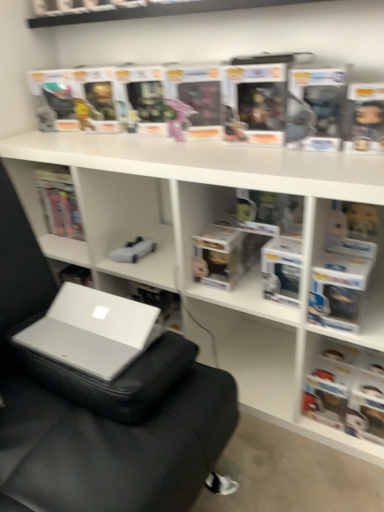
Question: Is silver/glossy laptop at lower left closer to the viewer compared to gray fabric bean bag chair at center?

Choices:
 (A) no
 (B) yes

Answer: (A)

Question: From a real-world perspective, does silver/glossy laptop at lower left stand above gray fabric bean bag chair at center?

Choices:
 (A) yes
 (B) no

Answer: (A)

Question: Can you confirm if silver/glossy laptop at lower left is positioned to the right of gray fabric bean bag chair at center?

Choices:
 (A) no
 (B) yes

Answer: (A)

Question: Is silver/glossy laptop at lower left far from gray fabric bean bag chair at center?

Choices:
 (A) yes
 (B) no

Answer: (B)

Question: Is silver/glossy laptop at lower left at the left side of gray fabric bean bag chair at center?

Choices:
 (A) yes
 (B) no

Answer: (A)

Question: Is point (380, 415) closer or farther from the camera than point (39, 332)?

Choices:
 (A) closer
 (B) farther

Answer: (B)

Question: In the image, is matte black book at right positioned in front of or behind silver/glossy laptop at lower left?

Choices:
 (A) behind
 (B) front

Answer: (A)

Question: From a real-world perspective, relative to silver/glossy laptop at lower left, is matte black book at right vertically above or below?

Choices:
 (A) below
 (B) above

Answer: (A)

Question: From their relative heights in the image, would you say matte black book at right is taller or shorter than silver/glossy laptop at lower left?

Choices:
 (A) tall
 (B) short

Answer: (A)

Question: Considering the positions of silver/glossy laptop at lower left and gray fabric bean bag chair at center in the image, is silver/glossy laptop at lower left taller or shorter than gray fabric bean bag chair at center?

Choices:
 (A) short
 (B) tall

Answer: (A)

Question: Does point (54, 353) appear closer or farther from the camera than point (195, 495)?

Choices:
 (A) farther
 (B) closer

Answer: (A)

Question: From the image's perspective, is silver/glossy laptop at lower left positioned above or below gray fabric bean bag chair at center?

Choices:
 (A) above
 (B) below

Answer: (B)

Question: Considering the positions of silver/glossy laptop at lower left and gray fabric bean bag chair at center in the image, is silver/glossy laptop at lower left bigger or smaller than gray fabric bean bag chair at center?

Choices:
 (A) small
 (B) big

Answer: (A)

Question: Would you say matte black book at right is inside or outside gray fabric bean bag chair at center?

Choices:
 (A) outside
 (B) inside

Answer: (B)

Question: Is point (380, 381) positioned closer to the camera than point (148, 440)?

Choices:
 (A) closer
 (B) farther

Answer: (B)